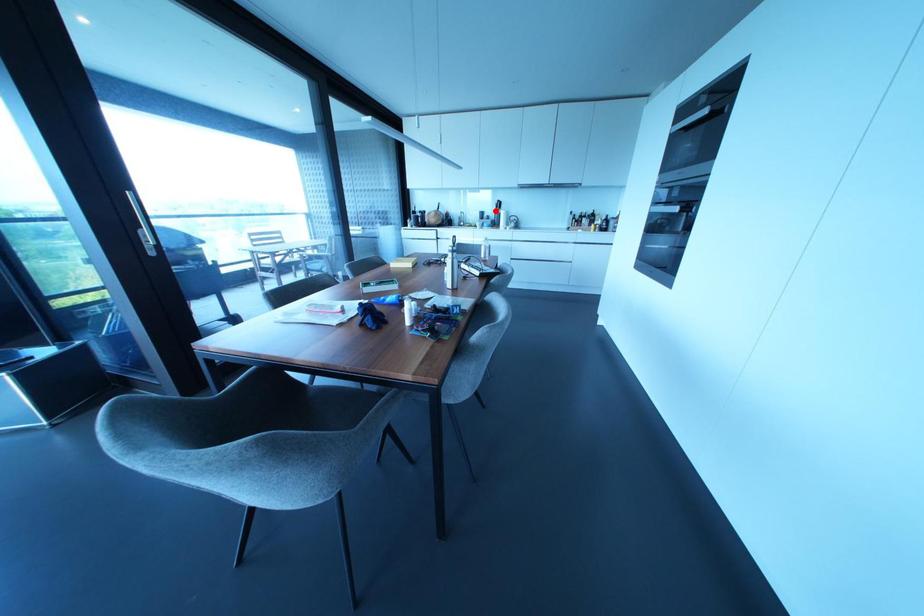
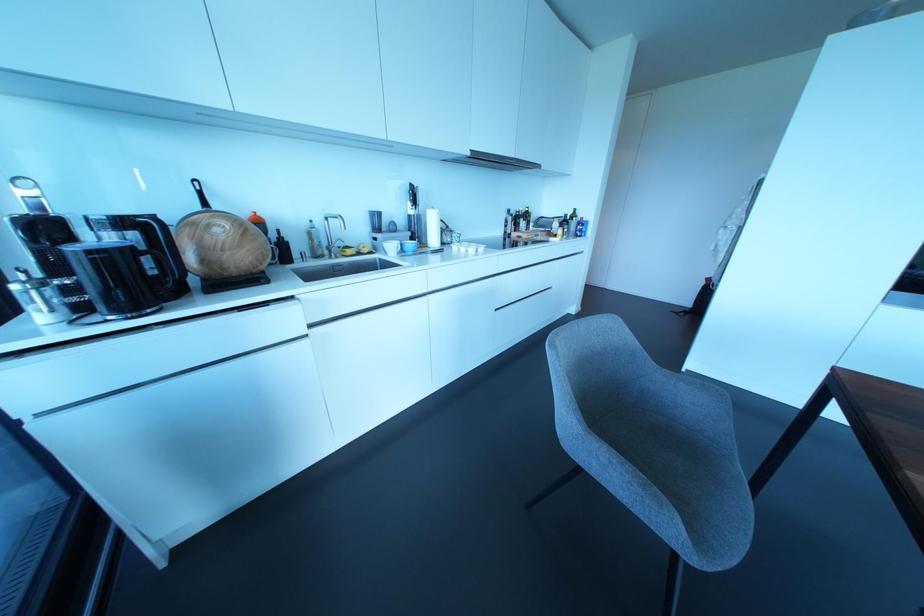
Locate, in the second image, the point that corresponds to the highlighted location in the first image.

(410, 211)